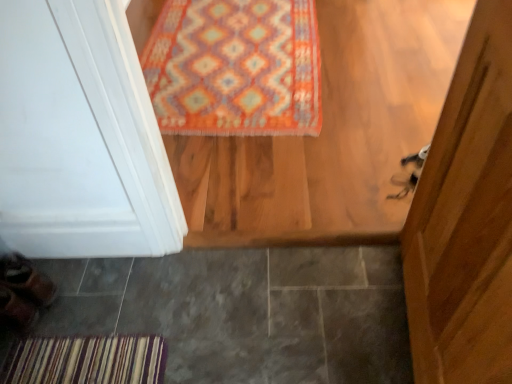
Question: Is gray tile at lower left inside or outside of multicolored woven rug at upper center?

Choices:
 (A) inside
 (B) outside

Answer: (B)

Question: From the image's perspective, is gray tile at lower left located above or below multicolored woven rug at upper center?

Choices:
 (A) below
 (B) above

Answer: (A)

Question: Estimate the real-world distances between objects in this image. Which object is closer to the brown leather shoe at lower left, which is the first shoe from top to bottom?

Choices:
 (A) leather brown shoe at lower left, the 1th shoe ordered from the bottom
 (B) multicolored woven rug at upper center
 (C) gray tile at lower left

Answer: (A)

Question: Considering the real-world distances, which object is closest to the leather brown shoe at lower left, the 1th shoe ordered from the bottom?

Choices:
 (A) gray tile at lower left
 (B) brown leather shoe at lower left, which is the first shoe from top to bottom
 (C) multicolored woven rug at upper center

Answer: (B)